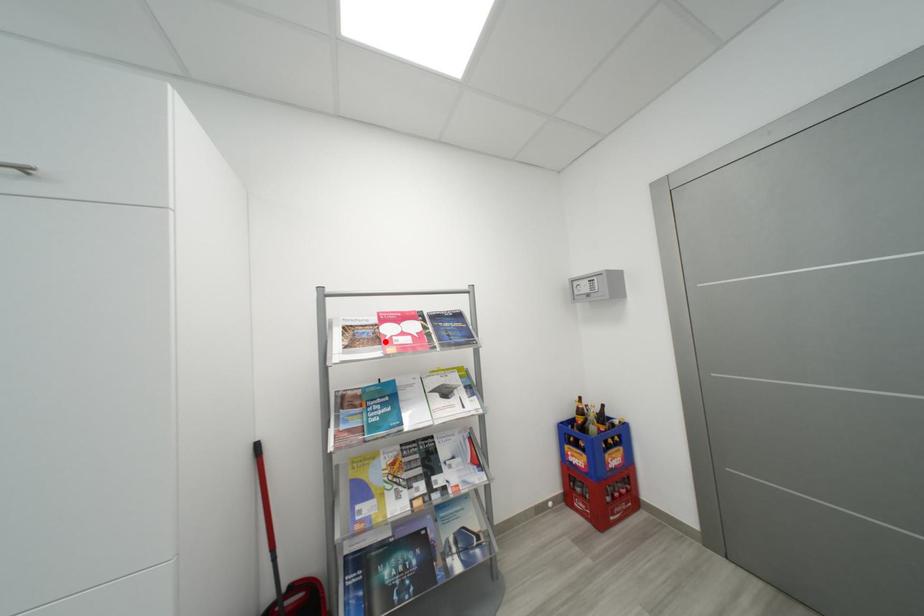
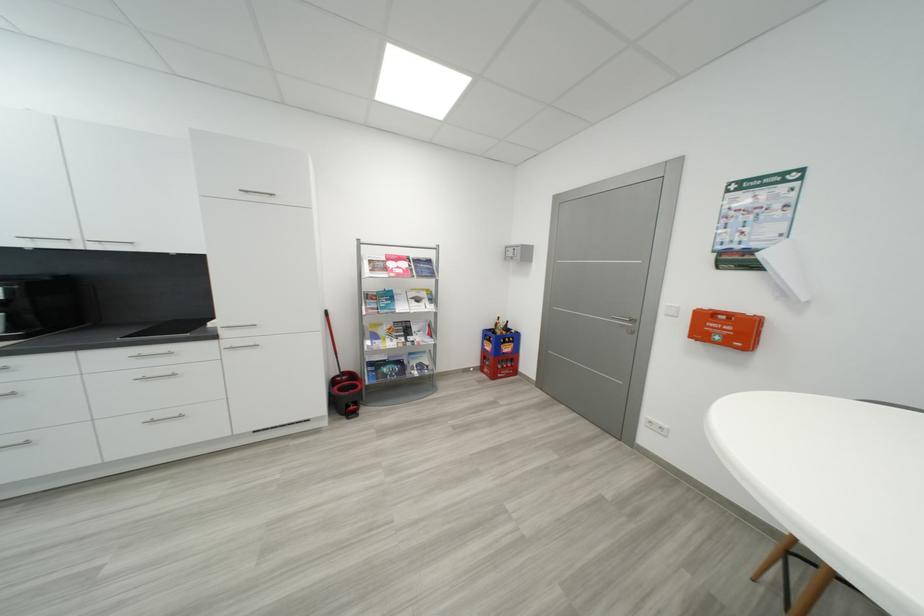
Where in the second image is the point corresponding to the highlighted location from the first image?

(393, 270)